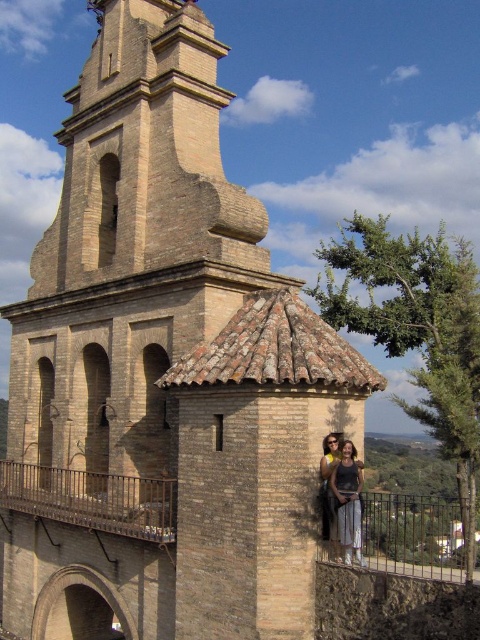
Looking at this image, you are a maintenance worker standing at the base of the bell tower. You need to inspect two points on the tower structure. The first point is at coordinates point (166,492) and the second is at point (333,545). Which point will require you to climb higher up the tower to reach?

Point (333,545) will require climbing higher because it is farther from the camera, indicating it is higher up the tower structure.

You are a tourist standing at the base of the historic stone bell tower. You want to take a photo of the rustic metal railing at center from a safe distance. The recommended safe distance for such structures is at least 30 meters. Can you safely take the photo from where you are standing?

The distance between you and the rustic metal railing at center is 31.01 meters, which exceeds the recommended safe distance of 30 meters. Therefore, you can safely take the photo from your current position.